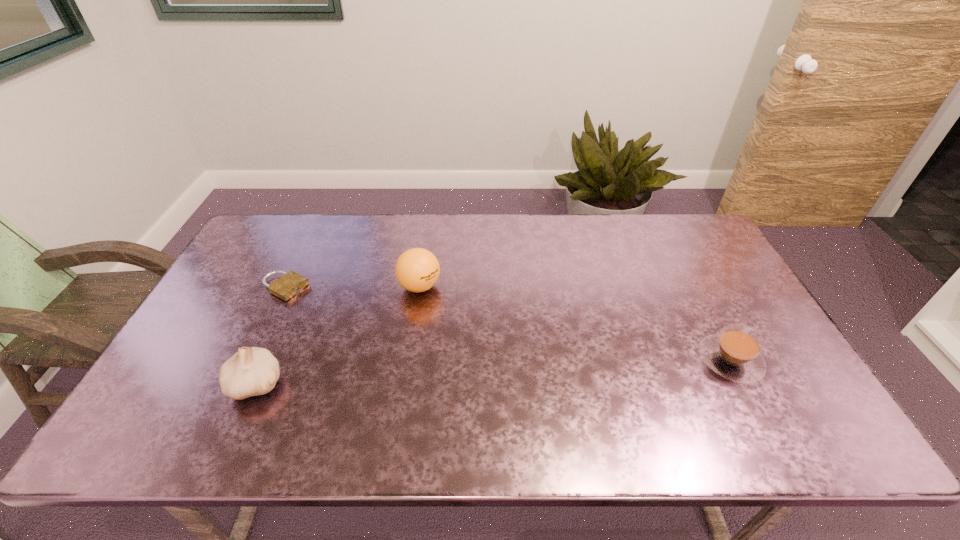
The height and width of the screenshot is (540, 960). Find the location of `unoccupied area between the ping-pong ball and the shortest object`. unoccupied area between the ping-pong ball and the shortest object is located at coordinates tap(352, 287).

Locate an element on the screen. The width and height of the screenshot is (960, 540). vacant space that's between the shortest object and the rightmost object is located at coordinates (508, 324).

At what (x,y) coordinates should I click in order to perform the action: click on empty space between the padlock and the garlic. Please return your answer as a coordinate pair (x, y). Image resolution: width=960 pixels, height=540 pixels. Looking at the image, I should click on (271, 336).

Where is `free space that is in between the padlock and the cappuccino`? Image resolution: width=960 pixels, height=540 pixels. free space that is in between the padlock and the cappuccino is located at coordinates (508, 324).

Identify which object is the nearest to the rightmost object. Please provide its 2D coordinates. Your answer should be formatted as a tuple, i.e. [(x, y)], where the tuple contains the x and y coordinates of a point satisfying the conditions above.

[(417, 270)]

Where is `the third closest object to the ping-pong ball`? the third closest object to the ping-pong ball is located at coordinates (735, 354).

I want to click on free spot that satisfies the following two spatial constraints: 1. on the back side of the rightmost object; 2. on the right side of the garlic, so click(x=267, y=360).

Where is `free space that satisfies the following two spatial constraints: 1. on the front side of the garlic; 2. on the right side of the shortest object`? The height and width of the screenshot is (540, 960). free space that satisfies the following two spatial constraints: 1. on the front side of the garlic; 2. on the right side of the shortest object is located at coordinates (239, 384).

Find the location of a particular element. This screenshot has width=960, height=540. vacant position in the image that satisfies the following two spatial constraints: 1. on the front side of the padlock; 2. on the right side of the cappuccino is located at coordinates (251, 360).